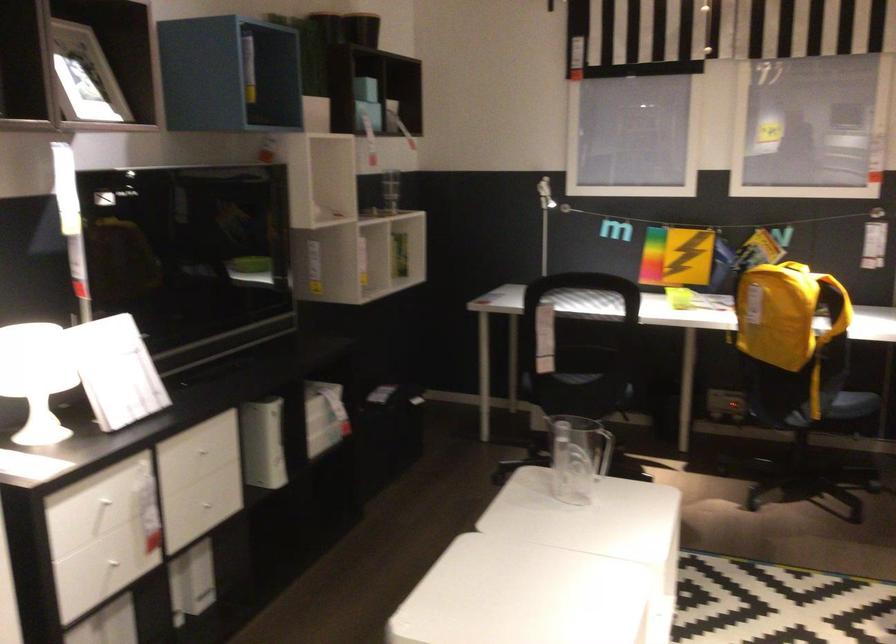
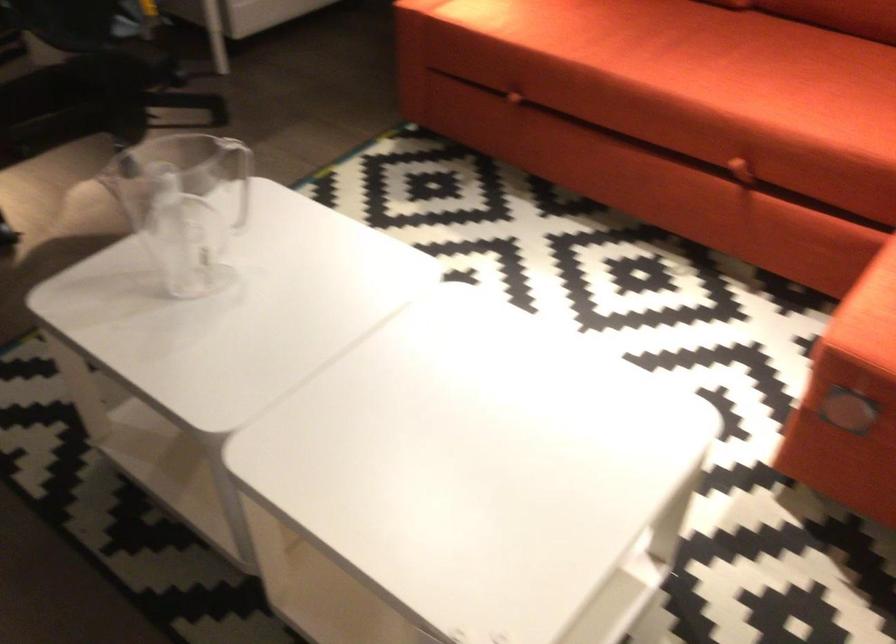
Locate, in the second image, the point that corresponds to point (823, 540) in the first image.

(238, 176)